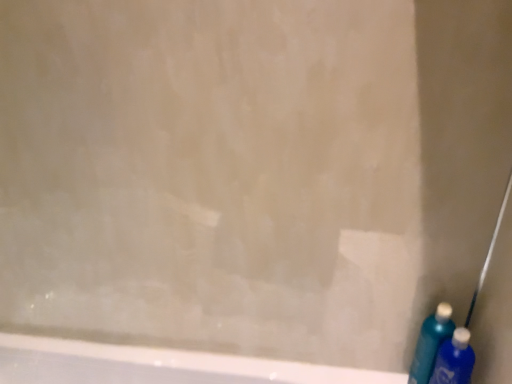
Image resolution: width=512 pixels, height=384 pixels. What do you see at coordinates (431, 343) in the screenshot?
I see `blue glossy bottle at lower right, arranged as the second cleaning product when viewed from the front` at bounding box center [431, 343].

Locate an element on the screen. blue glossy bottle at lower right, arranged as the second cleaning product when viewed from the front is located at coordinates (431, 343).

Consider the image. How much space does blue glossy bottle at lower right, arranged as the second cleaning product when viewed from the front, occupy vertically?

blue glossy bottle at lower right, arranged as the second cleaning product when viewed from the front, is 10.33 inches in height.

Find the location of a particular element. This screenshot has width=512, height=384. blue plastic bottle at lower right, acting as the first cleaning product starting from the front is located at coordinates (454, 359).

What do you see at coordinates (454, 359) in the screenshot? The width and height of the screenshot is (512, 384). I see `blue plastic bottle at lower right, marked as the second cleaning product in a back-to-front arrangement` at bounding box center [454, 359].

Find the location of a particular element. blue glossy bottle at lower right, the first cleaning product in the back-to-front sequence is located at coordinates (431, 343).

Does blue plastic bottle at lower right, marked as the second cleaning product in a back-to-front arrangement, appear on the right side of blue glossy bottle at lower right, arranged as the second cleaning product when viewed from the front?

Correct, you'll find blue plastic bottle at lower right, marked as the second cleaning product in a back-to-front arrangement, to the right of blue glossy bottle at lower right, arranged as the second cleaning product when viewed from the front.

In the image, is blue plastic bottle at lower right, marked as the second cleaning product in a back-to-front arrangement, positioned in front of or behind blue glossy bottle at lower right, arranged as the second cleaning product when viewed from the front?

Clearly, blue plastic bottle at lower right, marked as the second cleaning product in a back-to-front arrangement, is in front of blue glossy bottle at lower right, arranged as the second cleaning product when viewed from the front.

Does point (437, 368) lie behind point (432, 362)?

No, it is not.

From the image's perspective, is blue plastic bottle at lower right, acting as the first cleaning product starting from the front, below blue glossy bottle at lower right, arranged as the second cleaning product when viewed from the front?

Correct, blue plastic bottle at lower right, acting as the first cleaning product starting from the front, appears lower than blue glossy bottle at lower right, arranged as the second cleaning product when viewed from the front, in the image.

From a real-world perspective, is blue plastic bottle at lower right, acting as the first cleaning product starting from the front, on top of blue glossy bottle at lower right, the first cleaning product in the back-to-front sequence?

No, from a real-world perspective, blue plastic bottle at lower right, acting as the first cleaning product starting from the front, is not over blue glossy bottle at lower right, the first cleaning product in the back-to-front sequence

In terms of width, does blue plastic bottle at lower right, marked as the second cleaning product in a back-to-front arrangement, look wider or thinner when compared to blue glossy bottle at lower right, the first cleaning product in the back-to-front sequence?

Clearly, blue plastic bottle at lower right, marked as the second cleaning product in a back-to-front arrangement, has more width compared to blue glossy bottle at lower right, the first cleaning product in the back-to-front sequence.

Does blue plastic bottle at lower right, marked as the second cleaning product in a back-to-front arrangement, have a greater height compared to blue glossy bottle at lower right, the first cleaning product in the back-to-front sequence?

No, blue plastic bottle at lower right, marked as the second cleaning product in a back-to-front arrangement, is not taller than blue glossy bottle at lower right, the first cleaning product in the back-to-front sequence.

Looking at this image, which of these two, blue plastic bottle at lower right, marked as the second cleaning product in a back-to-front arrangement, or blue glossy bottle at lower right, arranged as the second cleaning product when viewed from the front, is bigger?

blue plastic bottle at lower right, marked as the second cleaning product in a back-to-front arrangement.

Does blue plastic bottle at lower right, acting as the first cleaning product starting from the front, contain blue glossy bottle at lower right, arranged as the second cleaning product when viewed from the front?

No, blue plastic bottle at lower right, acting as the first cleaning product starting from the front, does not contain blue glossy bottle at lower right, arranged as the second cleaning product when viewed from the front.

Consider the image. Is the surface of blue plastic bottle at lower right, marked as the second cleaning product in a back-to-front arrangement, in direct contact with blue glossy bottle at lower right, the first cleaning product in the back-to-front sequence?

Absolutely, blue plastic bottle at lower right, marked as the second cleaning product in a back-to-front arrangement, is next to and touching blue glossy bottle at lower right, the first cleaning product in the back-to-front sequence.

Is blue glossy bottle at lower right, the first cleaning product in the back-to-front sequence, at the back of blue plastic bottle at lower right, acting as the first cleaning product starting from the front?

Yes, blue glossy bottle at lower right, the first cleaning product in the back-to-front sequence, is at the back of blue plastic bottle at lower right, acting as the first cleaning product starting from the front.

Find the location of a particular element. The image size is (512, 384). cleaning product lying on the left of blue plastic bottle at lower right, acting as the first cleaning product starting from the front is located at coordinates (431, 343).

Is blue glossy bottle at lower right, arranged as the second cleaning product when viewed from the front, to the left or to the right of blue plastic bottle at lower right, acting as the first cleaning product starting from the front, in the image?

In the image, blue glossy bottle at lower right, arranged as the second cleaning product when viewed from the front, appears on the left side of blue plastic bottle at lower right, acting as the first cleaning product starting from the front.

In the image, is blue glossy bottle at lower right, the first cleaning product in the back-to-front sequence, positioned in front of or behind blue plastic bottle at lower right, acting as the first cleaning product starting from the front?

blue glossy bottle at lower right, the first cleaning product in the back-to-front sequence, is behind blue plastic bottle at lower right, acting as the first cleaning product starting from the front.

Is point (431, 334) positioned behind point (446, 375)?

Yes, point (431, 334) is behind point (446, 375).

From the image's perspective, which one is positioned lower, blue glossy bottle at lower right, arranged as the second cleaning product when viewed from the front, or blue plastic bottle at lower right, acting as the first cleaning product starting from the front?

blue plastic bottle at lower right, acting as the first cleaning product starting from the front.

From a real-world perspective, does blue glossy bottle at lower right, arranged as the second cleaning product when viewed from the front, sit lower than blue plastic bottle at lower right, marked as the second cleaning product in a back-to-front arrangement?

Actually, blue glossy bottle at lower right, arranged as the second cleaning product when viewed from the front, is physically above blue plastic bottle at lower right, marked as the second cleaning product in a back-to-front arrangement, in the real world.

Based on the photo, looking at their sizes, would you say blue glossy bottle at lower right, arranged as the second cleaning product when viewed from the front, is wider or thinner than blue plastic bottle at lower right, marked as the second cleaning product in a back-to-front arrangement?

Considering their sizes, blue glossy bottle at lower right, arranged as the second cleaning product when viewed from the front, looks slimmer than blue plastic bottle at lower right, marked as the second cleaning product in a back-to-front arrangement.

Between blue glossy bottle at lower right, the first cleaning product in the back-to-front sequence, and blue plastic bottle at lower right, marked as the second cleaning product in a back-to-front arrangement, which one has more height?

With more height is blue glossy bottle at lower right, the first cleaning product in the back-to-front sequence.

Is blue glossy bottle at lower right, arranged as the second cleaning product when viewed from the front, smaller than blue plastic bottle at lower right, marked as the second cleaning product in a back-to-front arrangement?

Indeed, blue glossy bottle at lower right, arranged as the second cleaning product when viewed from the front, has a smaller size compared to blue plastic bottle at lower right, marked as the second cleaning product in a back-to-front arrangement.

Would you say blue glossy bottle at lower right, arranged as the second cleaning product when viewed from the front, is inside or outside blue plastic bottle at lower right, marked as the second cleaning product in a back-to-front arrangement?

blue glossy bottle at lower right, arranged as the second cleaning product when viewed from the front, exists outside the volume of blue plastic bottle at lower right, marked as the second cleaning product in a back-to-front arrangement.

Would you say blue glossy bottle at lower right, the first cleaning product in the back-to-front sequence, is a long distance from blue plastic bottle at lower right, acting as the first cleaning product starting from the front?

No, blue glossy bottle at lower right, the first cleaning product in the back-to-front sequence, is in close proximity to blue plastic bottle at lower right, acting as the first cleaning product starting from the front.

Could you tell me if blue glossy bottle at lower right, arranged as the second cleaning product when viewed from the front, is turned towards blue plastic bottle at lower right, marked as the second cleaning product in a back-to-front arrangement?

Yes, blue glossy bottle at lower right, arranged as the second cleaning product when viewed from the front, is turned towards blue plastic bottle at lower right, marked as the second cleaning product in a back-to-front arrangement.

How many degrees apart are the facing directions of blue glossy bottle at lower right, the first cleaning product in the back-to-front sequence, and blue plastic bottle at lower right, acting as the first cleaning product starting from the front?

22.1 degrees separate the facing orientations of blue glossy bottle at lower right, the first cleaning product in the back-to-front sequence, and blue plastic bottle at lower right, acting as the first cleaning product starting from the front.

Where is `cleaning product above the blue plastic bottle at lower right, marked as the second cleaning product in a back-to-front arrangement (from a real-world perspective)`? Image resolution: width=512 pixels, height=384 pixels. cleaning product above the blue plastic bottle at lower right, marked as the second cleaning product in a back-to-front arrangement (from a real-world perspective) is located at coordinates (431, 343).

I want to click on cleaning product on the left of blue plastic bottle at lower right, acting as the first cleaning product starting from the front, so click(431, 343).

Image resolution: width=512 pixels, height=384 pixels. I want to click on cleaning product that appears below the blue glossy bottle at lower right, the first cleaning product in the back-to-front sequence (from the image's perspective), so click(454, 359).